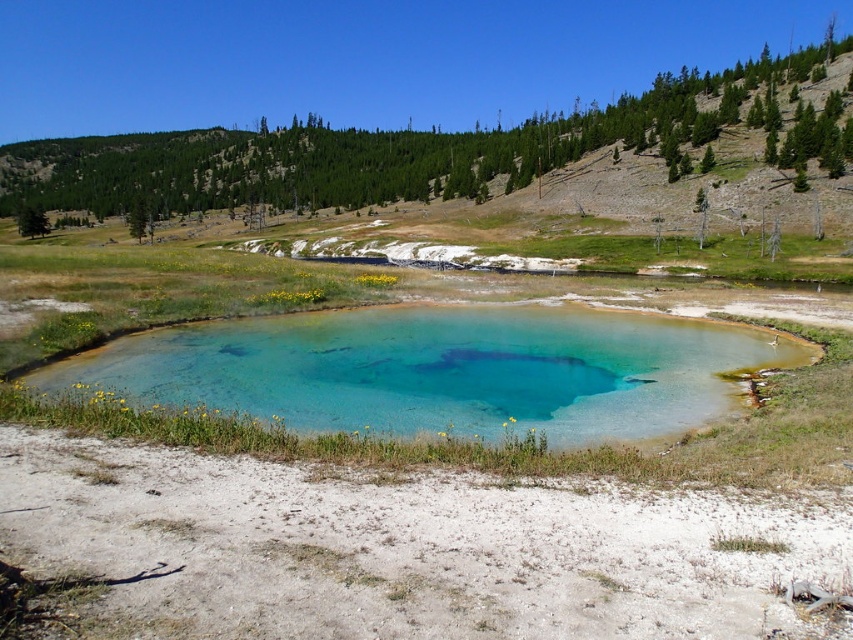
Question: Can you confirm if turquoise glass pond at center is positioned below green grassy hillside at upper center?

Choices:
 (A) yes
 (B) no

Answer: (A)

Question: Which object appears closest to the camera in this image?

Choices:
 (A) turquoise glass pond at center
 (B) green grassy hillside at upper center

Answer: (A)

Question: Which object is closer to the camera taking this photo?

Choices:
 (A) turquoise glass pond at center
 (B) green grassy hillside at upper center

Answer: (A)

Question: Can you confirm if turquoise glass pond at center is wider than green grassy hillside at upper center?

Choices:
 (A) yes
 (B) no

Answer: (B)

Question: Is turquoise glass pond at center thinner than green grassy hillside at upper center?

Choices:
 (A) no
 (B) yes

Answer: (B)

Question: Which point is farther from the camera taking this photo?

Choices:
 (A) (39, 168)
 (B) (378, 388)

Answer: (A)